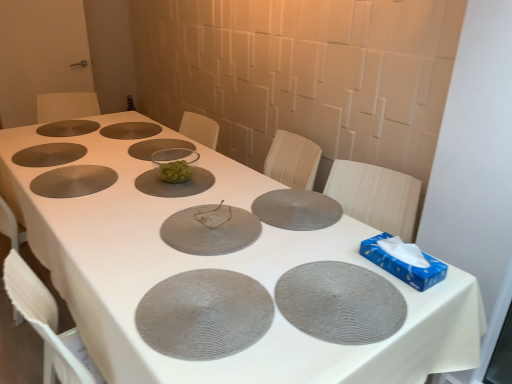
This screenshot has width=512, height=384. I want to click on blank space situated above matte gray glass plate at upper left, the 10th glass plate positioned from the front (from a real-world perspective), so click(63, 124).